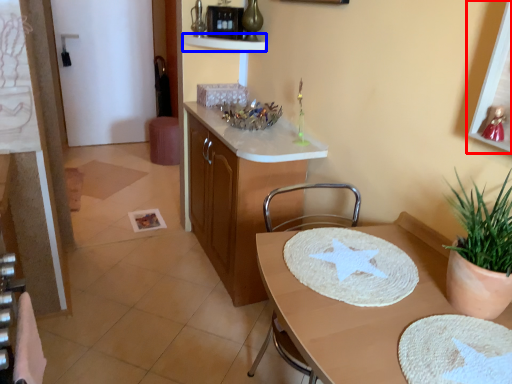
Question: Which object appears closest to the camera in this image, picture frame (highlighted by a red box) or shelf (highlighted by a blue box)?

Choices:
 (A) picture frame
 (B) shelf

Answer: (A)